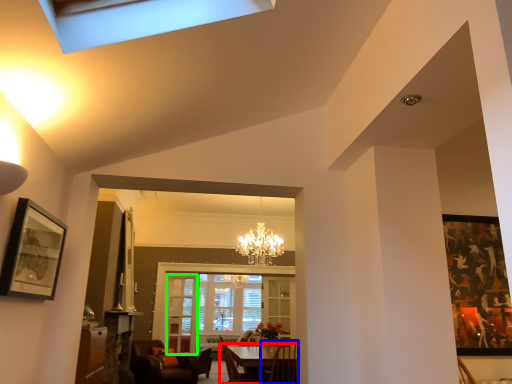
Question: Based on their relative distances, which object is nearer to table (highlighted by a red box)? Choose from chair (highlighted by a blue box) and glass door (highlighted by a green box).

Choices:
 (A) chair
 (B) glass door

Answer: (A)